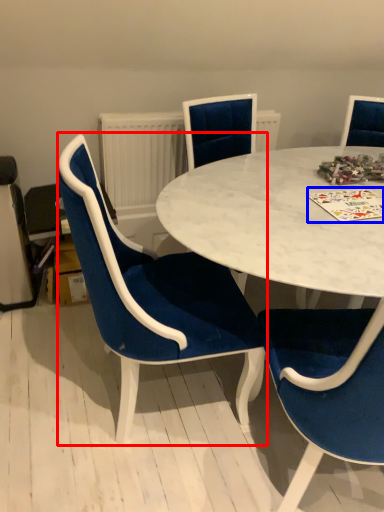
Question: Which object appears farthest to the camera in this image, chair (highlighted by a red box) or card game (highlighted by a blue box)?

Choices:
 (A) chair
 (B) card game

Answer: (B)